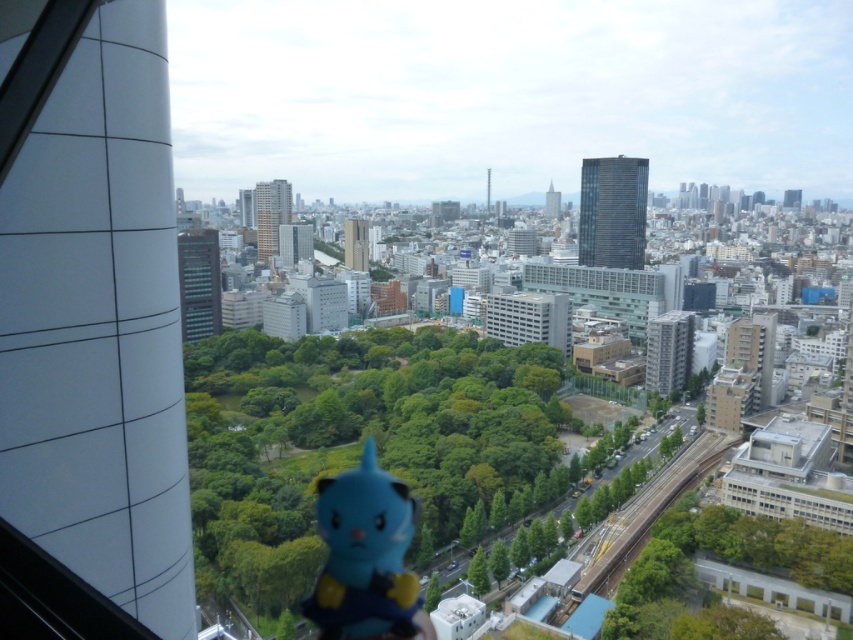
Does green leafy trees at center appear on the left side of transparent glass window at center?

Indeed, green leafy trees at center is positioned on the left side of transparent glass window at center.

Is point (430, 362) positioned in front of point (801, 602)?

No, it is not.

Identify the location of green leafy trees at center. pyautogui.click(x=360, y=442).

Locate an element on the screen. green leafy trees at center is located at coordinates (360, 442).

Is blue rubber toy at center smaller than green leafy tree at lower right?

No.

Which of these two, blue rubber toy at center or green leafy tree at lower right, stands taller?

Standing taller between the two is blue rubber toy at center.

Which is behind, point (418, 604) or point (822, 536)?

The point (822, 536) is more distant.

You are a GUI agent. You are given a task and a screenshot of the screen. Output one action in this format:
    pyautogui.click(x=<x>, y=<y>)
    Task: Click on the blue rubber toy at center
    
    Given the screenshot: What is the action you would take?
    pyautogui.click(x=364, y=556)

Does green leafy trees at center have a greater height compared to transparent plastic window at lower right?

Correct, green leafy trees at center is much taller as transparent plastic window at lower right.

Is green leafy trees at center thinner than transparent plastic window at lower right?

No.

Between point (549, 403) and point (770, 592), which one is positioned in front?

Point (770, 592) is in front.

Where is `green leafy trees at center`? Image resolution: width=853 pixels, height=640 pixels. green leafy trees at center is located at coordinates (360, 442).